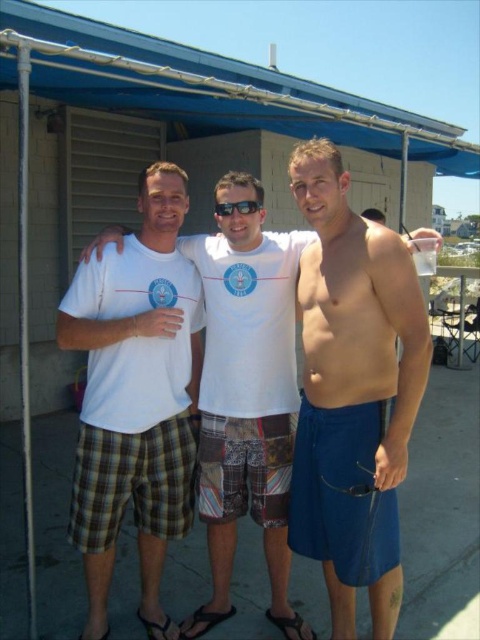
Is plaid shorts at left below black plastic goggles at center?

Yes.

Can you confirm if plaid shorts at left is positioned above black plastic goggles at center?

No, plaid shorts at left is not above black plastic goggles at center.

Which is in front, point (149, 577) or point (248, 204)?

Point (248, 204)

Where is `plaid shorts at left`? Image resolution: width=480 pixels, height=640 pixels. plaid shorts at left is located at coordinates (135, 397).

What do you see at coordinates (162, 205) in the screenshot?
I see `white cotton t-shirt at center` at bounding box center [162, 205].

Between white cotton t-shirt at center and black plastic goggles at center, which one appears on the left side from the viewer's perspective?

white cotton t-shirt at center

Between point (109, 339) and point (228, 204), which one is positioned in front?

Point (109, 339) is more forward.

The width and height of the screenshot is (480, 640). Find the location of `white cotton t-shirt at center`. white cotton t-shirt at center is located at coordinates (162, 205).

Measure the distance between blue fabric shorts at center and camera.

blue fabric shorts at center is 6.85 feet from camera.

Consider the image. Measure the distance from blue fabric shorts at center to white cotton t-shirt at center.

blue fabric shorts at center is 52.77 centimeters away from white cotton t-shirt at center.

The image size is (480, 640). Identify the location of blue fabric shorts at center. (352, 392).

Find the location of `blue fabric shorts at center`. blue fabric shorts at center is located at coordinates (352, 392).